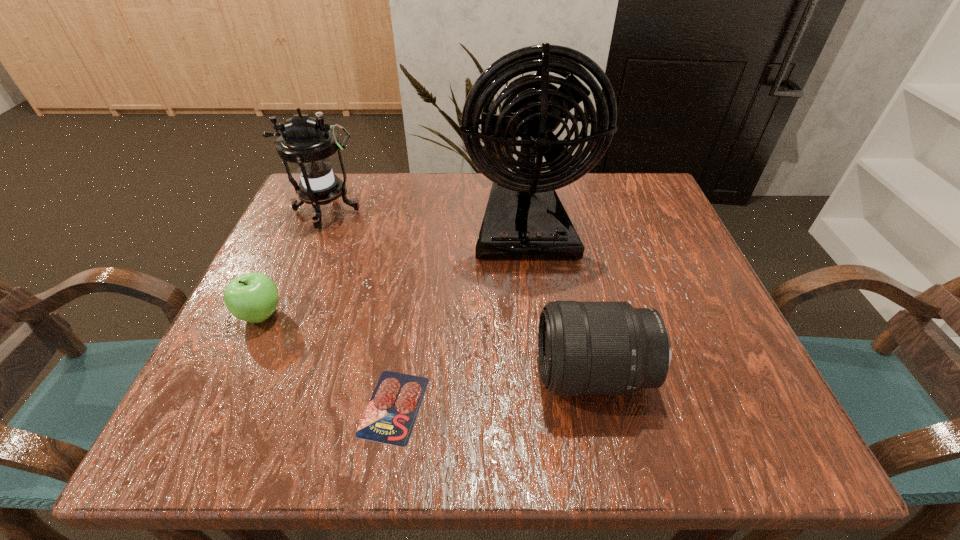
The height and width of the screenshot is (540, 960). In order to click on the tallest object in this screenshot , I will do [524, 218].

In order to click on the fourth shortest object in this screenshot , I will do `click(308, 142)`.

At what (x,y) coordinates should I click in order to perform the action: click on telephoto lens. Please return your answer as a coordinate pair (x, y). Image resolution: width=960 pixels, height=540 pixels. Looking at the image, I should click on pos(585,348).

I want to click on the third farthest object, so click(x=253, y=297).

The height and width of the screenshot is (540, 960). In order to click on apple in this screenshot , I will do `click(253, 297)`.

Where is `salami`? This screenshot has width=960, height=540. salami is located at coordinates (390, 416).

The width and height of the screenshot is (960, 540). Identify the location of the third object from left to right. (390, 416).

Image resolution: width=960 pixels, height=540 pixels. In order to click on vacant space located in front of the fan to blow air in this screenshot , I will do `click(540, 353)`.

The height and width of the screenshot is (540, 960). I want to click on vacant position located 0.280m on the right of the fourth shortest object, so click(483, 211).

At what (x,y) coordinates should I click in order to perform the action: click on blank area located 0.380m on the surface of the third shortest object. Please return your answer as a coordinate pair (x, y). The width and height of the screenshot is (960, 540). Looking at the image, I should click on (302, 374).